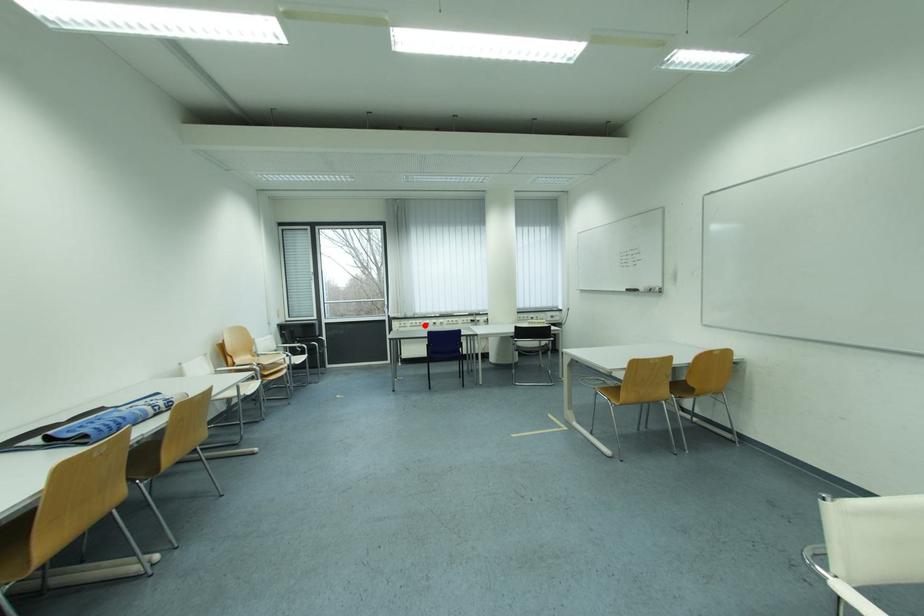
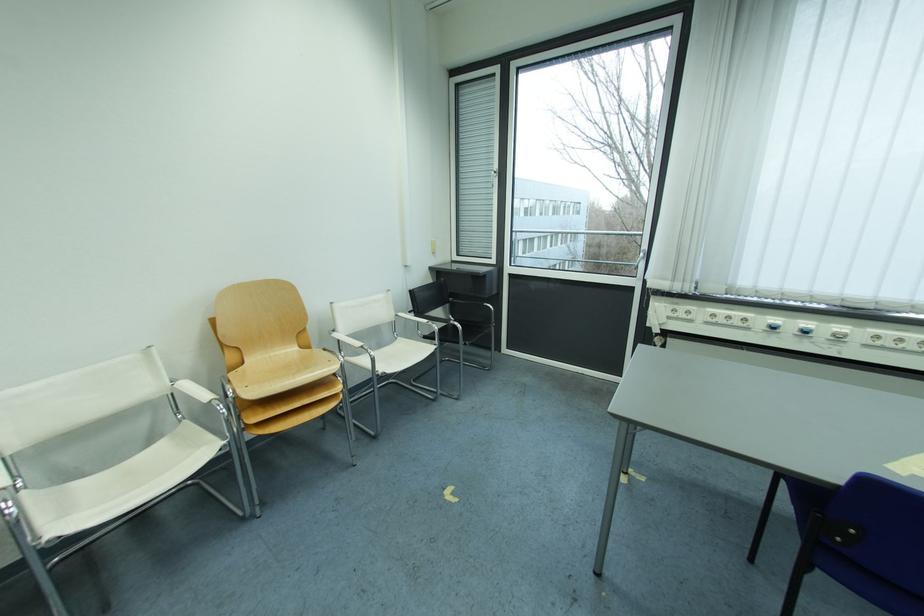
Where in the second image is the point corresponding to the highlighted location from the first image?

(737, 320)